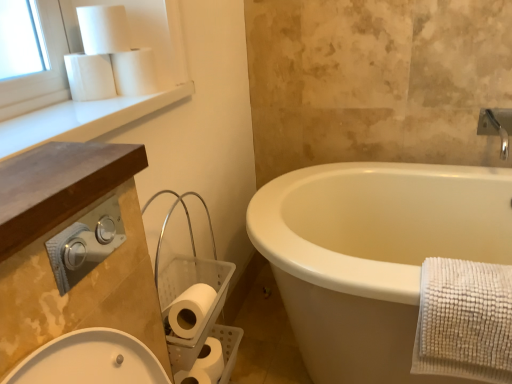
Question: From the image's perspective, is white smooth window sill at upper left above or below white matte toilet paper at upper left, acting as the 5th toilet paper starting from the bottom?

Choices:
 (A) above
 (B) below

Answer: (B)

Question: In terms of width, does white smooth window sill at upper left look wider or thinner when compared to white matte toilet paper at upper left, acting as the 5th toilet paper starting from the bottom?

Choices:
 (A) wide
 (B) thin

Answer: (A)

Question: Estimate the real-world distances between objects in this image. Which object is farther from the white matte toilet paper at upper left, which is the 4th toilet paper from bottom to top?

Choices:
 (A) silver metallic towel bar at left
 (B) white matte toilet paper at lower center, acting as the fifth toilet paper starting from the top
 (C) white smooth window sill at upper left
 (D) white matte toilet paper at lower left, the 4th toilet paper from the top
 (E) brown wood countertop at upper left

Answer: (B)

Question: Which of these objects is positioned farthest from the white matte toilet paper at upper left, arranged as the second toilet paper when viewed from the top?

Choices:
 (A) white smooth window sill at upper left
 (B) white matte toilet paper at upper left, acting as the third toilet paper starting from the top
 (C) silver metallic towel bar at left
 (D) white textured bath towel at right
 (E) white matte toilet paper at upper left, acting as the 5th toilet paper starting from the bottom

Answer: (D)